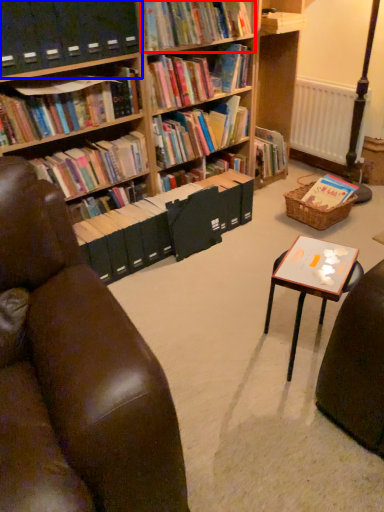
Question: Which of the following is the farthest to the observer, book (highlighted by a red box) or shelf (highlighted by a blue box)?

Choices:
 (A) book
 (B) shelf

Answer: (A)